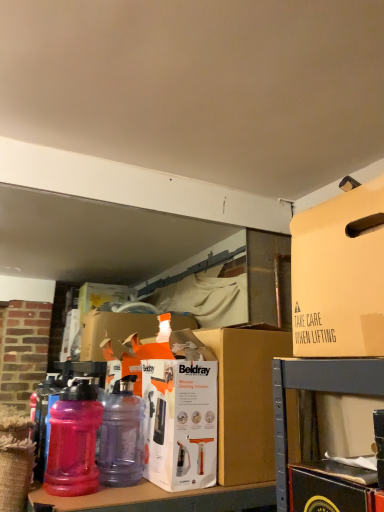
Question: Are brown cardboard box at center and translucent purple bottle at center, which ranks as the 2th bottle in left-to-right order, far apart?

Choices:
 (A) no
 (B) yes

Answer: (A)

Question: Can you confirm if brown cardboard box at center is positioned to the right of translucent purple bottle at center, which ranks as the 2th bottle in left-to-right order?

Choices:
 (A) no
 (B) yes

Answer: (B)

Question: Considering the relative sizes of brown cardboard box at center and translucent purple bottle at center, which ranks as the 2th bottle in left-to-right order, in the image provided, is brown cardboard box at center thinner than translucent purple bottle at center, which ranks as the 2th bottle in left-to-right order,?

Choices:
 (A) yes
 (B) no

Answer: (B)

Question: Considering the relative sizes of brown cardboard box at center and translucent purple bottle at center, which ranks as the 2th bottle in left-to-right order, in the image provided, is brown cardboard box at center wider than translucent purple bottle at center, which ranks as the 2th bottle in left-to-right order,?

Choices:
 (A) yes
 (B) no

Answer: (A)

Question: From a real-world perspective, is brown cardboard box at center over translucent purple bottle at center, which ranks as the 2th bottle in left-to-right order?

Choices:
 (A) yes
 (B) no

Answer: (A)

Question: In terms of size, does beige cardboard box at upper right appear bigger or smaller than translucent purple bottle at center, which is counted as the 1th bottle, starting from the right?

Choices:
 (A) big
 (B) small

Answer: (A)

Question: Which is correct: beige cardboard box at upper right is inside translucent purple bottle at center, which ranks as the 2th bottle in left-to-right order, or outside of it?

Choices:
 (A) inside
 (B) outside

Answer: (B)

Question: Is beige cardboard box at upper right in front of or behind translucent purple bottle at center, which is counted as the 1th bottle, starting from the right, in the image?

Choices:
 (A) behind
 (B) front

Answer: (B)

Question: In terms of width, does beige cardboard box at upper right look wider or thinner when compared to translucent purple bottle at center, which is counted as the 1th bottle, starting from the right?

Choices:
 (A) thin
 (B) wide

Answer: (B)

Question: Considering their positions, is translucent purple bottle at center, which is counted as the 1th bottle, starting from the right, located in front of or behind pink translucent water bottle at lower left, the 2th bottle viewed from the right?

Choices:
 (A) behind
 (B) front

Answer: (A)

Question: Based on their sizes in the image, would you say translucent purple bottle at center, which ranks as the 2th bottle in left-to-right order, is bigger or smaller than pink translucent water bottle at lower left, the 1th bottle in the left-to-right sequence?

Choices:
 (A) small
 (B) big

Answer: (A)

Question: Is translucent purple bottle at center, which is counted as the 1th bottle, starting from the right, inside or outside of pink translucent water bottle at lower left, the 1th bottle in the left-to-right sequence?

Choices:
 (A) outside
 (B) inside

Answer: (A)

Question: From their relative heights in the image, would you say translucent purple bottle at center, which is counted as the 1th bottle, starting from the right, is taller or shorter than pink translucent water bottle at lower left, the 2th bottle viewed from the right?

Choices:
 (A) tall
 (B) short

Answer: (A)

Question: Based on their sizes in the image, would you say brown cardboard box at center is bigger or smaller than beige cardboard box at upper right?

Choices:
 (A) big
 (B) small

Answer: (A)

Question: In the image, is brown cardboard box at center positioned in front of or behind beige cardboard box at upper right?

Choices:
 (A) behind
 (B) front

Answer: (A)